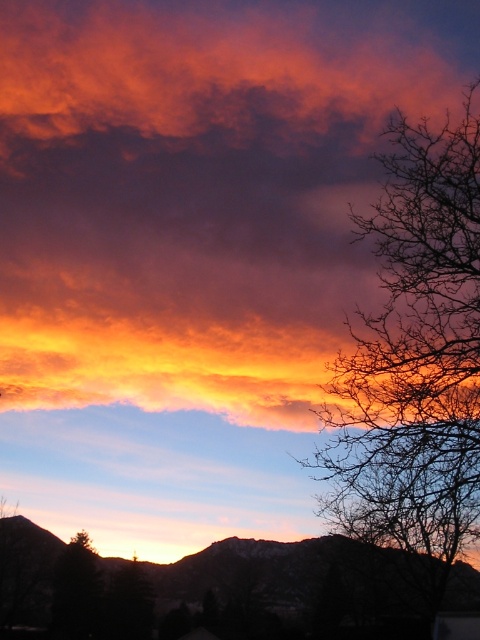
Based on the photo, is vivid orange cloud at upper center below bare branches at right?

Incorrect, vivid orange cloud at upper center is not positioned below bare branches at right.

Is point (367, 115) positioned before point (424, 275)?

That is False.

Locate an element on the screen. vivid orange cloud at upper center is located at coordinates (199, 192).